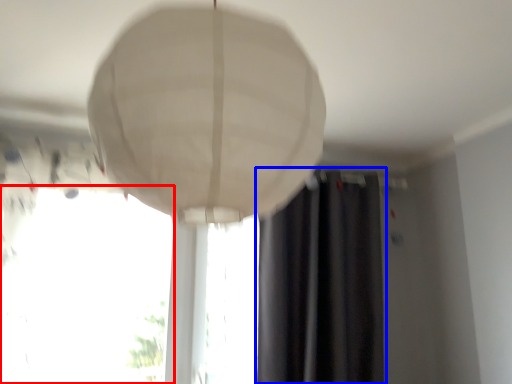
Question: Which object is closer to the camera taking this photo, window (highlighted by a red box) or curtain (highlighted by a blue box)?

Choices:
 (A) window
 (B) curtain

Answer: (A)